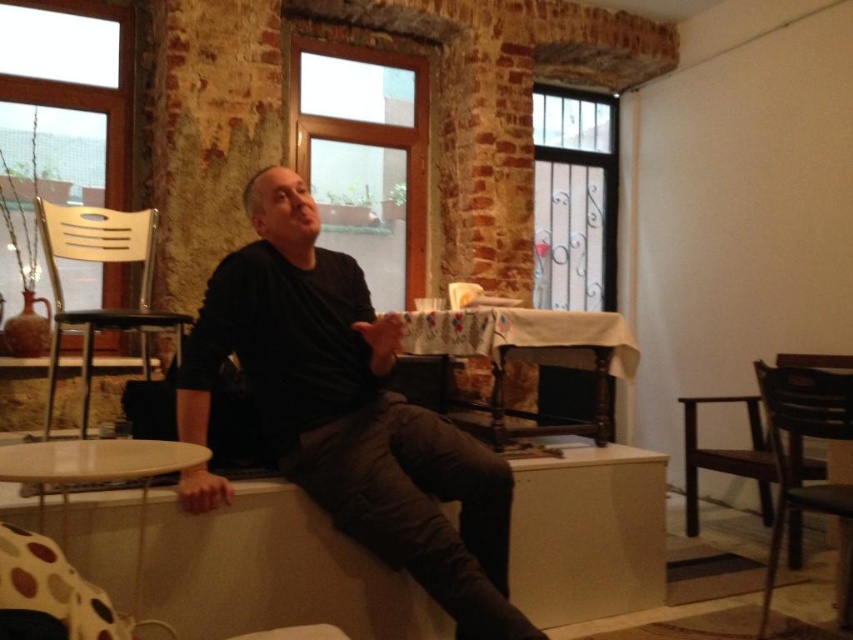
Question: Estimate the real-world distances between objects in this image. Which object is farther from the clear glass window at upper center?

Choices:
 (A) brown wooden chair at lower right
 (B) brown wooden chair at right

Answer: (A)

Question: Estimate the real-world distances between objects in this image. Which object is closer to the transparent glass window at upper left?

Choices:
 (A) clear glass window at center
 (B) white plastic chair at left
 (C) black matte shirt at center
 (D) clear glass window at upper center

Answer: (B)

Question: Does white plastic chair at left have a larger size compared to brown wooden chair at right?

Choices:
 (A) yes
 (B) no

Answer: (B)

Question: Is brown wooden chair at lower right to the left of brown wooden chair at right from the viewer's perspective?

Choices:
 (A) no
 (B) yes

Answer: (B)

Question: Which object is farther from the camera taking this photo?

Choices:
 (A) clear glass window at upper center
 (B) white plastic chair at left

Answer: (A)

Question: From the image, what is the correct spatial relationship of clear glass window at upper center in relation to white plastic chair at left?

Choices:
 (A) left
 (B) right

Answer: (B)